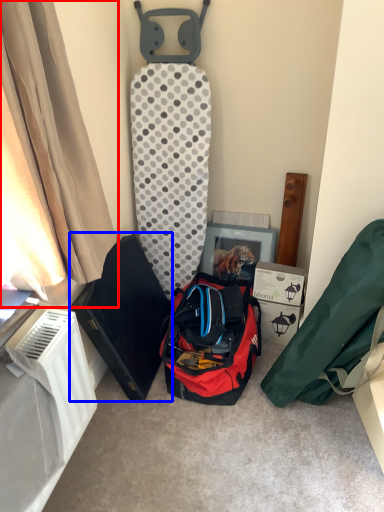
Question: Which object is further to the camera taking this photo, curtain (highlighted by a red box) or kit (highlighted by a blue box)?

Choices:
 (A) curtain
 (B) kit

Answer: (B)